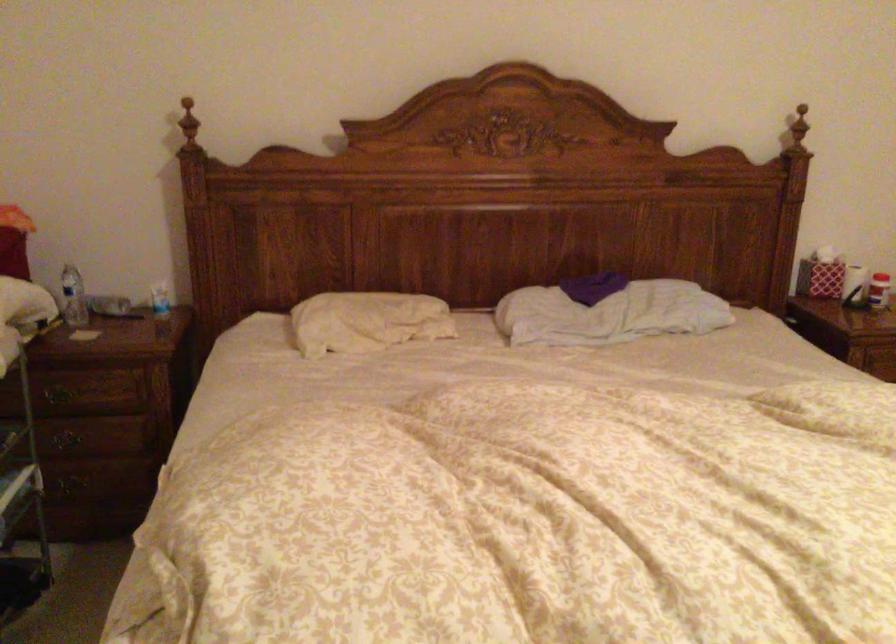
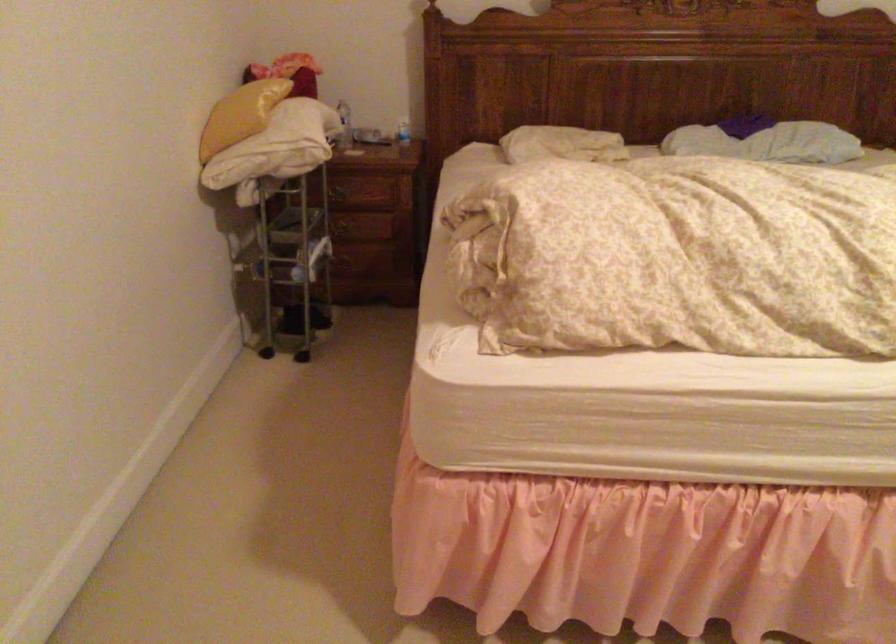
The point at (358, 328) is marked in the first image. Where is the corresponding point in the second image?

(561, 144)